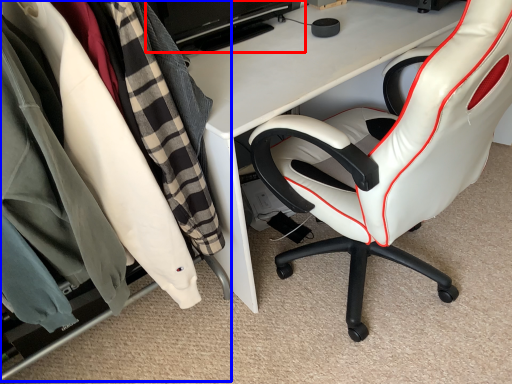
Question: Which object appears farthest to the camera in this image, computer monitor (highlighted by a red box) or closet (highlighted by a blue box)?

Choices:
 (A) computer monitor
 (B) closet

Answer: (A)